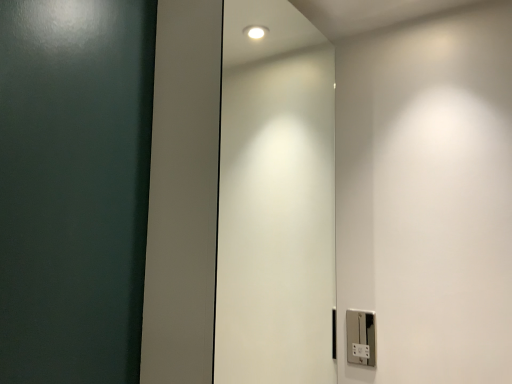
Describe the element at coordinates (275, 200) in the screenshot. The width and height of the screenshot is (512, 384). I see `white glossy elevator door at center` at that location.

The image size is (512, 384). Identify the location of white glossy elevator door at center. click(275, 200).

In order to face silver metallic light switch at lower right, should I rotate leftwards or rightwards?

A 13.830 degree turn to the right will do.

The image size is (512, 384). What do you see at coordinates (361, 338) in the screenshot?
I see `silver metallic light switch at lower right` at bounding box center [361, 338].

You are a GUI agent. You are given a task and a screenshot of the screen. Output one action in this format:
    pyautogui.click(x=<x>, y=<y>)
    Task: Click on the silver metallic light switch at lower right
    The height and width of the screenshot is (384, 512).
    Given the screenshot: What is the action you would take?
    pyautogui.click(x=361, y=338)

This screenshot has height=384, width=512. Find the location of `white glossy elevator door at center`. white glossy elevator door at center is located at coordinates (275, 200).

Looking at this image, considering the positions of objects white glossy elevator door at center and silver metallic light switch at lower right in the image provided, who is more to the left, white glossy elevator door at center or silver metallic light switch at lower right?

white glossy elevator door at center.

Which is behind, white glossy elevator door at center or silver metallic light switch at lower right?

silver metallic light switch at lower right.

Is point (302, 112) closer or farther from the camera than point (355, 319)?

Point (302, 112).

From the image's perspective, which object appears higher, white glossy elevator door at center or silver metallic light switch at lower right?

white glossy elevator door at center is shown above in the image.

From a real-world perspective, which is physically above, white glossy elevator door at center or silver metallic light switch at lower right?

In real-world perspective, white glossy elevator door at center is above.

Considering the sizes of objects white glossy elevator door at center and silver metallic light switch at lower right in the image provided, who is thinner, white glossy elevator door at center or silver metallic light switch at lower right?

silver metallic light switch at lower right is thinner.

Does white glossy elevator door at center have a greater height compared to silver metallic light switch at lower right?

Yes.

Is white glossy elevator door at center smaller than silver metallic light switch at lower right?

Incorrect, white glossy elevator door at center is not smaller in size than silver metallic light switch at lower right.

Is white glossy elevator door at center inside the boundaries of silver metallic light switch at lower right, or outside?

white glossy elevator door at center is outside silver metallic light switch at lower right.

Are white glossy elevator door at center and silver metallic light switch at lower right making contact?

No, white glossy elevator door at center is not touching silver metallic light switch at lower right.

Could you tell me if white glossy elevator door at center is facing silver metallic light switch at lower right?

No, white glossy elevator door at center is not turned towards silver metallic light switch at lower right.

What's the angular difference between white glossy elevator door at center and silver metallic light switch at lower right's facing directions?

white glossy elevator door at center and silver metallic light switch at lower right are facing 92.5 degrees away from each other.

From the picture: How much distance is there between white glossy elevator door at center and silver metallic light switch at lower right?

46.78 centimeters.

At what (x,y) coordinates should I click in order to perform the action: click on light switch below the white glossy elevator door at center (from the image's perspective). Please return your answer as a coordinate pair (x, y). Looking at the image, I should click on (361, 338).

Which is more to the left, silver metallic light switch at lower right or white glossy elevator door at center?

From the viewer's perspective, white glossy elevator door at center appears more on the left side.

Considering their positions, is silver metallic light switch at lower right located in front of or behind white glossy elevator door at center?

A: Visually, silver metallic light switch at lower right is located behind white glossy elevator door at center.

Looking at this image, which is more distant, (351, 335) or (250, 363)?

The point (250, 363) is more distant.

From the image's perspective, would you say silver metallic light switch at lower right is positioned over white glossy elevator door at center?

No, from the image's perspective, silver metallic light switch at lower right is not on top of white glossy elevator door at center.

From a real-world perspective, is silver metallic light switch at lower right positioned over white glossy elevator door at center based on gravity?

No, from a real-world perspective, silver metallic light switch at lower right is not on top of white glossy elevator door at center.

Is silver metallic light switch at lower right thinner than white glossy elevator door at center?

Indeed, silver metallic light switch at lower right has a lesser width compared to white glossy elevator door at center.

Does silver metallic light switch at lower right have a lesser height compared to white glossy elevator door at center?

Indeed, silver metallic light switch at lower right has a lesser height compared to white glossy elevator door at center.

Does silver metallic light switch at lower right have a smaller size compared to white glossy elevator door at center?

Yes, silver metallic light switch at lower right is smaller than white glossy elevator door at center.

Could white glossy elevator door at center be considered to be inside silver metallic light switch at lower right?

No.

Is the surface of silver metallic light switch at lower right in direct contact with white glossy elevator door at center?

No, silver metallic light switch at lower right is not touching white glossy elevator door at center.

Does silver metallic light switch at lower right turn towards white glossy elevator door at center?

Yes, silver metallic light switch at lower right faces towards white glossy elevator door at center.

What's the angular difference between silver metallic light switch at lower right and white glossy elevator door at center's facing directions?

The facing directions of silver metallic light switch at lower right and white glossy elevator door at center are 92.5 degrees apart.

Find the location of `elevator door on the left of silver metallic light switch at lower right`. elevator door on the left of silver metallic light switch at lower right is located at coordinates (275, 200).

What are the coordinates of `elevator door in front of the silver metallic light switch at lower right` in the screenshot? It's located at (275, 200).

The width and height of the screenshot is (512, 384). I want to click on light switch below the white glossy elevator door at center (from the image's perspective), so click(x=361, y=338).